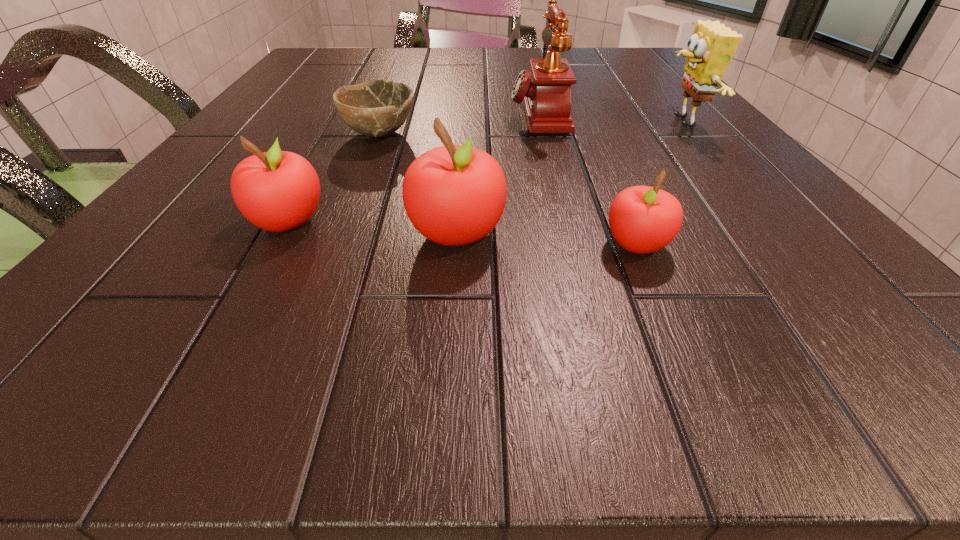
Image resolution: width=960 pixels, height=540 pixels. In order to click on vacant space that is in between the bowl and the second shortest object in this screenshot , I will do `click(508, 190)`.

Image resolution: width=960 pixels, height=540 pixels. Identify the location of empty space between the second tallest apple and the fourth object from right to left. (372, 228).

Find the location of `free space between the rightmost object and the fourth object from right to left`. free space between the rightmost object and the fourth object from right to left is located at coordinates (568, 178).

Identify the location of free space between the rightmost object and the telephone. (610, 119).

Locate an element on the screen. Image resolution: width=960 pixels, height=540 pixels. free area in between the sponge and the tallest apple is located at coordinates (568, 178).

Identify which object is located as the fifth nearest to the sponge. Please provide its 2D coordinates. Your answer should be formatted as a tuple, i.e. [(x, y)], where the tuple contains the x and y coordinates of a point satisfying the conditions above.

[(277, 191)]

Identify which object is located as the second nearest to the telephone. Please provide its 2D coordinates. Your answer should be formatted as a tuple, i.e. [(x, y)], where the tuple contains the x and y coordinates of a point satisfying the conditions above.

[(711, 47)]

Locate which apple is the closest to the fifth tallest object. Please provide its 2D coordinates. Your answer should be formatted as a tuple, i.e. [(x, y)], where the tuple contains the x and y coordinates of a point satisfying the conditions above.

[(454, 195)]

Identify the location of the second closest apple to the shortest object. (454, 195).

Locate an element on the screen. Image resolution: width=960 pixels, height=540 pixels. blank space that satisfies the following two spatial constraints: 1. on the dial of the telephone; 2. on the front side of the tallest apple is located at coordinates (566, 233).